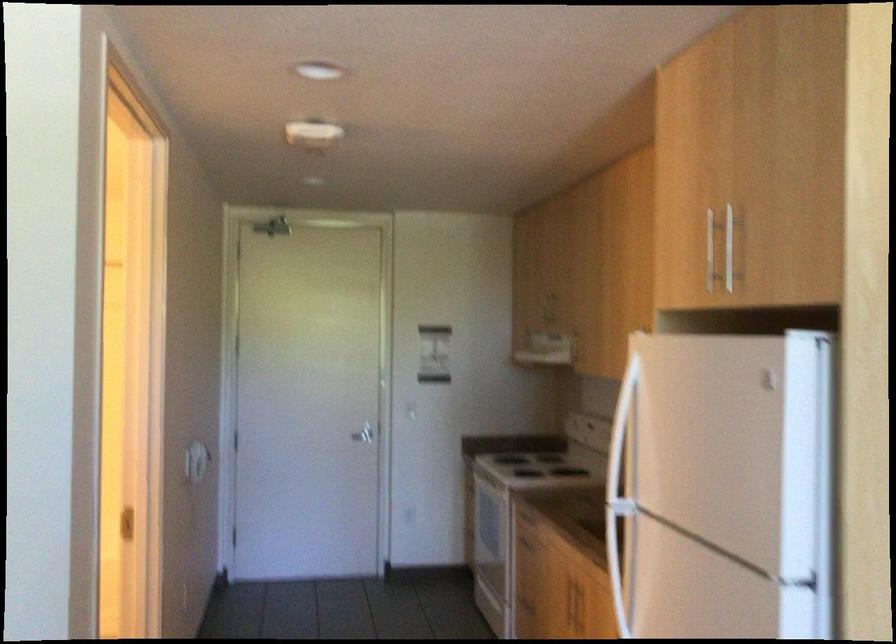
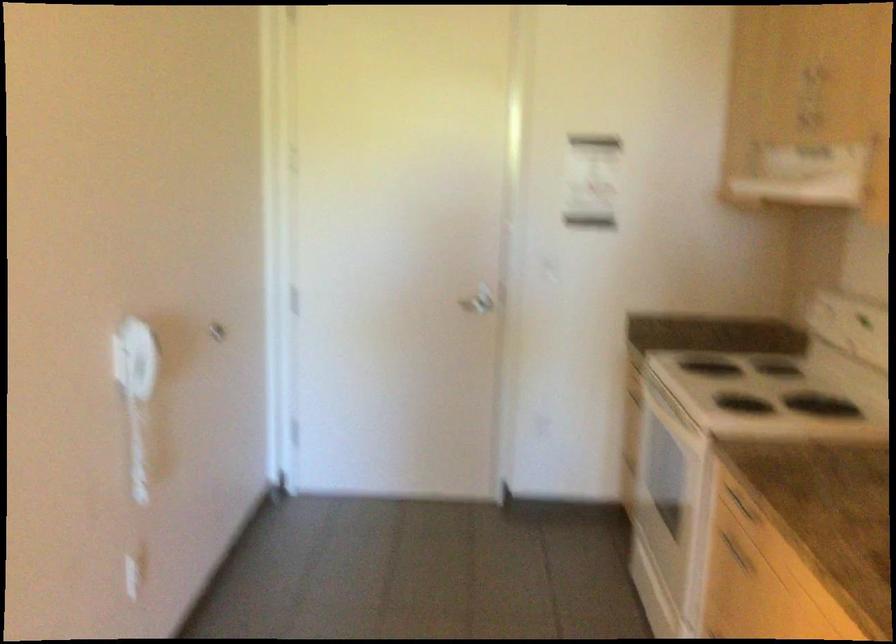
Where in the second image is the point corresponding to point 375,419 from the first image?

(478, 301)